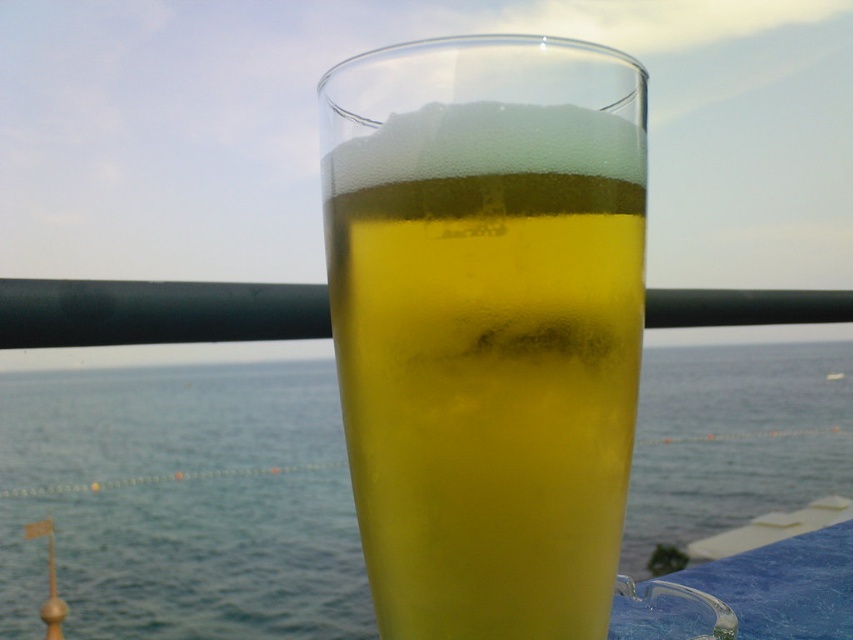
Question: Is translucent glass at center below translucent yellow liquid at center?

Choices:
 (A) yes
 (B) no

Answer: (B)

Question: Is translucent glass at center smaller than translucent yellow liquid at center?

Choices:
 (A) yes
 (B) no

Answer: (A)

Question: Which point is closer to the camera taking this photo?

Choices:
 (A) (440, 177)
 (B) (698, 358)

Answer: (A)

Question: Does translucent glass at center have a greater width compared to translucent yellow liquid at center?

Choices:
 (A) yes
 (B) no

Answer: (B)